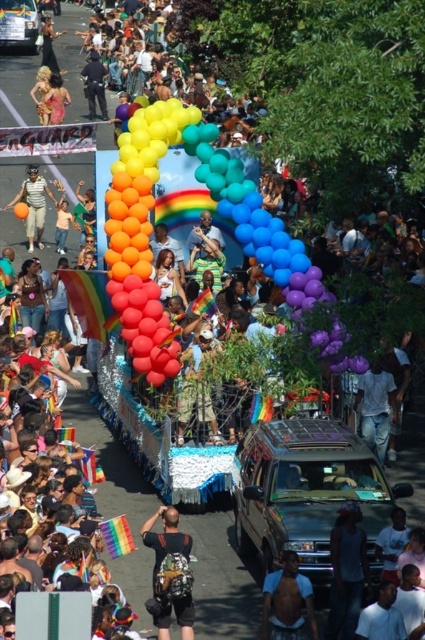
Question: Does shiny metallic shorts at lower center appear on the left side of black leather jacket at upper left?

Choices:
 (A) no
 (B) yes

Answer: (A)

Question: Is shiny black van at center to the left of matte gold bikini at upper left from the viewer's perspective?

Choices:
 (A) no
 (B) yes

Answer: (A)

Question: Does white cotton shirt at lower right have a greater width compared to matte black shirt at center?

Choices:
 (A) yes
 (B) no

Answer: (A)

Question: Which point is closer to the camera?

Choices:
 (A) (348, 545)
 (B) (294, 582)

Answer: (B)

Question: Which is farther from the dark blue fabric shirt at lower right?

Choices:
 (A) orange matte balloon at center
 (B) matte white pants at left
 (C) black backpack at lower center

Answer: (B)

Question: Which point is closer to the camera?

Choices:
 (A) matte black shirt at center
 (B) black backpack at lower center
 (C) matte white pants at left
 (D) orange matte balloon at center

Answer: (B)